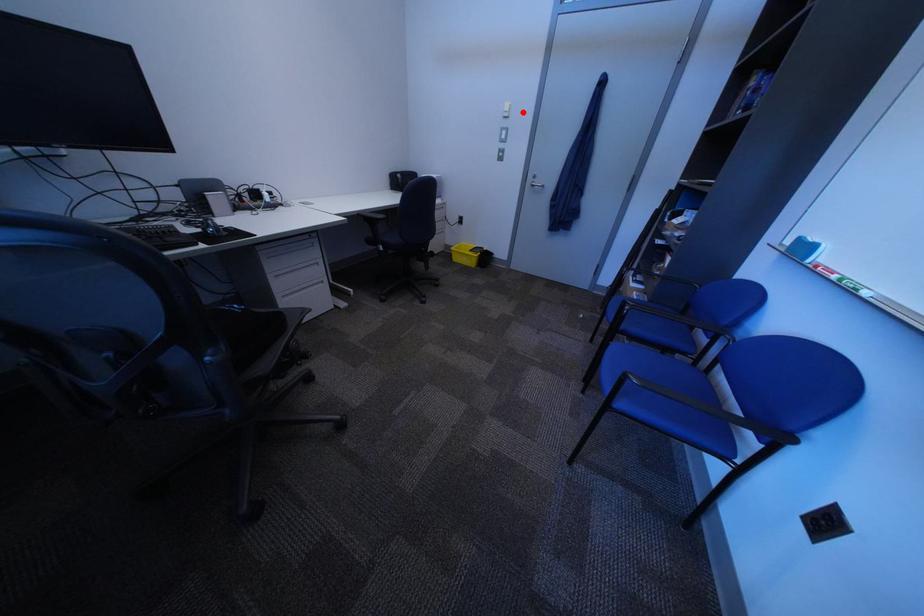
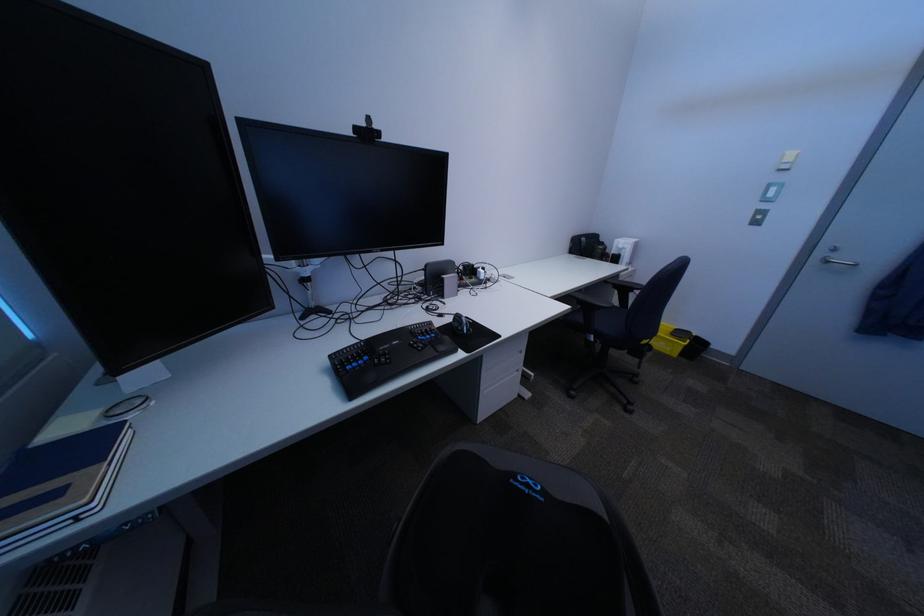
Locate, in the second image, the point that corresponds to the highlighted location in the first image.

(807, 163)